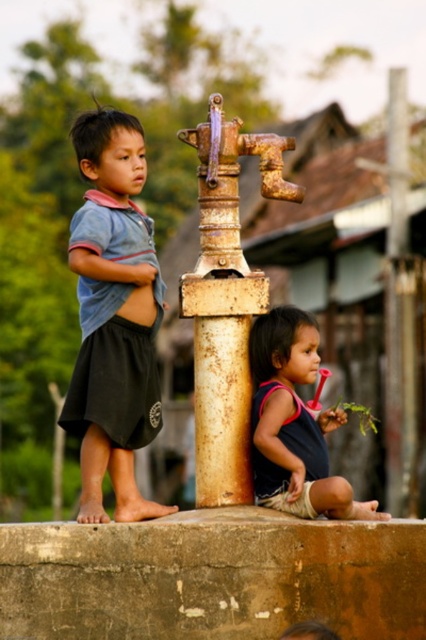
Is point (121, 337) positioned before point (370, 509)?

Yes, it is.

Is blue cotton shirt at left above dark blue fabric shirt at lower right?

Indeed, blue cotton shirt at left is positioned over dark blue fabric shirt at lower right.

Between point (80, 365) and point (333, 496), which one is positioned in front?

Point (333, 496)

The width and height of the screenshot is (426, 640). Identify the location of blue cotton shirt at left. (114, 317).

Is point (232, 369) more distant than point (316, 493)?

Yes, point (232, 369) is farther from viewer.

What do you see at coordinates (226, 301) in the screenshot? Image resolution: width=426 pixels, height=640 pixels. I see `rusty metal pole at center` at bounding box center [226, 301].

Find the location of `rusty metal pole at center`. rusty metal pole at center is located at coordinates (226, 301).

Does blue cotton shirt at left appear on the right side of rusty metal pole at center?

Incorrect, blue cotton shirt at left is not on the right side of rusty metal pole at center.

Does blue cotton shirt at left have a lesser width compared to rusty metal pole at center?

In fact, blue cotton shirt at left might be wider than rusty metal pole at center.

Is point (131, 387) positioned in front of point (259, 289)?

No, (131, 387) is further to viewer.

The image size is (426, 640). I want to click on blue cotton shirt at left, so click(x=114, y=317).